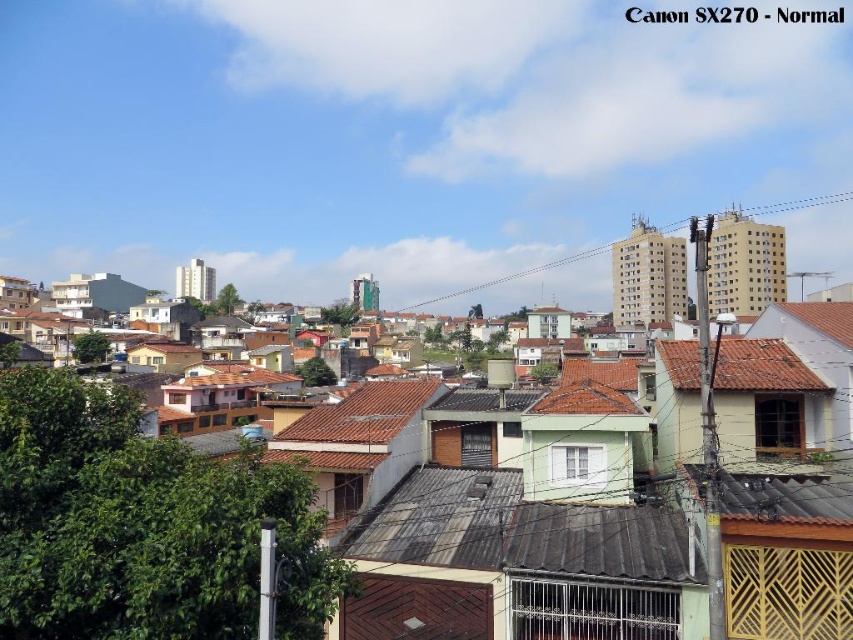
Who is lower down, brown tile roof at center-right or brown tile roof at center?

brown tile roof at center

Does brown tile roof at center-right have a lesser width compared to brown tile roof at center?

Yes, brown tile roof at center-right is thinner than brown tile roof at center.

Is point (749, 376) more distant than point (360, 397)?

That is False.

At what (x,y) coordinates should I click in order to perform the action: click on brown tile roof at center-right. Please return your answer as a coordinate pair (x, y). Looking at the image, I should click on (762, 368).